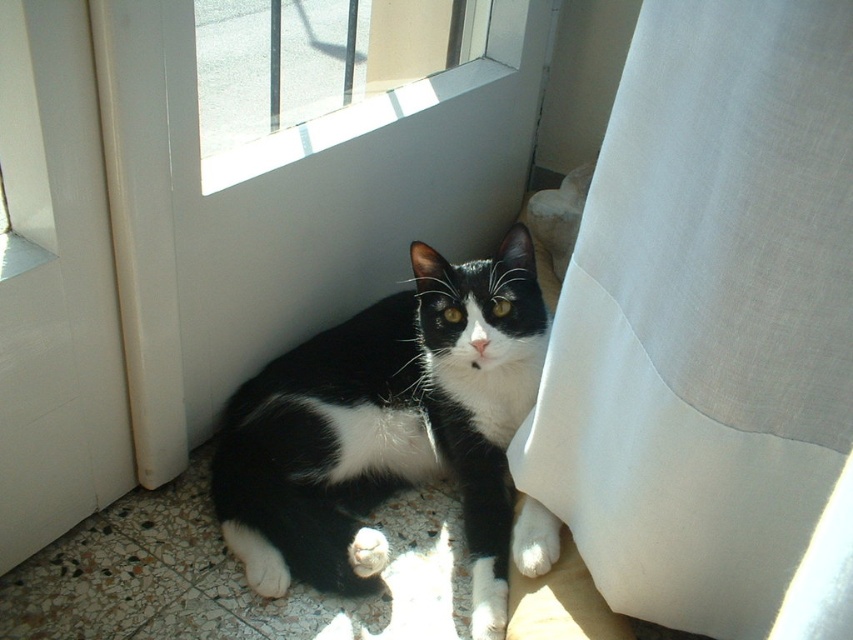
Question: Does white sheer curtain at lower right have a lesser width compared to black and white fur cat at center?

Choices:
 (A) yes
 (B) no

Answer: (A)

Question: Does white plastic screen door at upper center have a smaller size compared to white plastic screen door at lower left?

Choices:
 (A) no
 (B) yes

Answer: (A)

Question: Which object is closer to the camera taking this photo?

Choices:
 (A) white sheer curtain at lower right
 (B) white plastic screen door at upper center
 (C) white plastic screen door at lower left

Answer: (A)

Question: Is white plastic screen door at lower left closer to camera compared to white glass window at upper center?

Choices:
 (A) yes
 (B) no

Answer: (A)

Question: Based on their relative distances, which object is farther from the white sheer curtain at lower right?

Choices:
 (A) white plastic screen door at lower left
 (B) white glass window at upper center

Answer: (A)

Question: Estimate the real-world distances between objects in this image. Which object is farther from the white sheer curtain at lower right?

Choices:
 (A) white plastic screen door at lower left
 (B) black and white fur cat at center

Answer: (A)